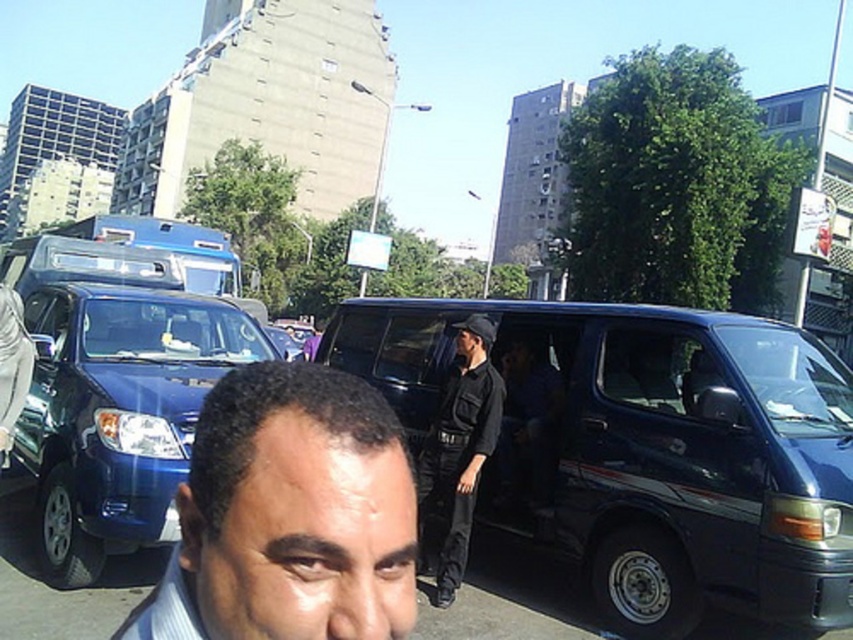
You are a pedestrian standing on the sidewalk and see the shiny dark blue van at center and the black uniform at center. Which object is closer to you?

The shiny dark blue van at center is closer to you because it is positioned over the black uniform at center, indicating it is in front of it.

You are standing at the point with coordinates point (x=375, y=502) and want to walk to the point with coordinates point (x=543, y=376). Which direction should you move in?

You should move backward because point (x=543, y=376) is behind point (x=375, y=502).

You are a delivery person who needs to load a large package into the shiny dark blue van at center. The package is as big as the black uniform at center. Will the package fit inside the van?

The shiny dark blue van at center is bigger than the black uniform at center, so the package, which is as big as the black uniform at center, will fit inside the shiny dark blue van at center.